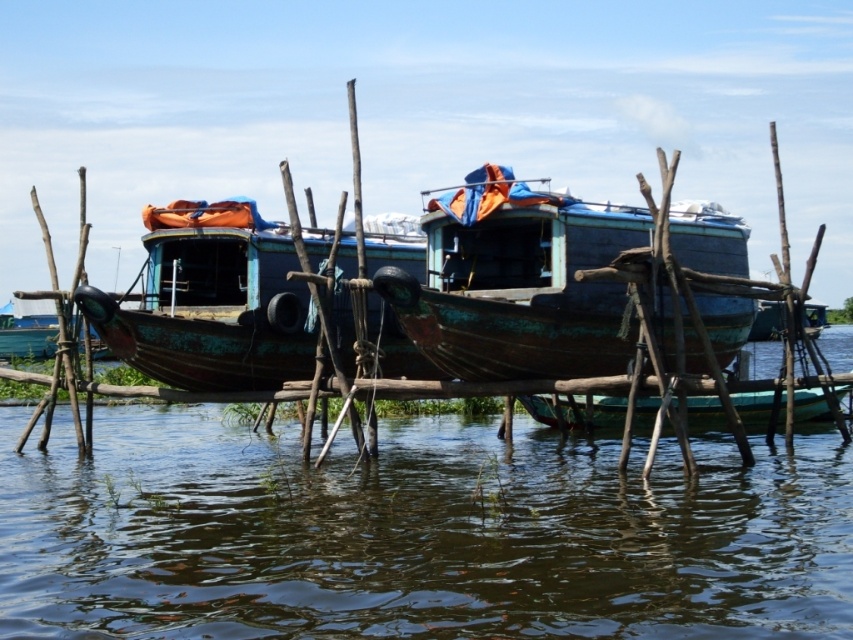
Question: Which object is farther from the camera taking this photo?

Choices:
 (A) rusty metal boat at center
 (B) brown murky water at center
 (C) rusty wood boat at center

Answer: (A)

Question: Which object is farther from the camera taking this photo?

Choices:
 (A) rusty metal boat at center
 (B) rusty wood boat at center

Answer: (A)

Question: Does brown murky water at center come in front of rusty wood boat at center?

Choices:
 (A) yes
 (B) no

Answer: (A)

Question: Based on their relative distances, which object is farther from the brown murky water at center?

Choices:
 (A) rusty metal boat at center
 (B) rusty wood boat at center

Answer: (B)

Question: Can you confirm if brown murky water at center is positioned to the right of rusty wood boat at center?

Choices:
 (A) yes
 (B) no

Answer: (B)

Question: Is brown murky water at center bigger than rusty wood boat at center?

Choices:
 (A) no
 (B) yes

Answer: (B)